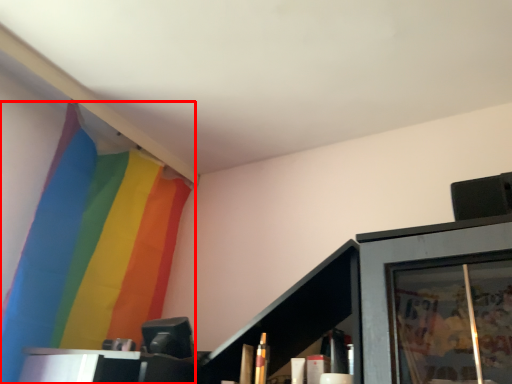
Question: From the image's perspective, what is the correct spatial relationship of curtain (annotated by the red box) in relation to cabinet?

Choices:
 (A) above
 (B) below

Answer: (A)